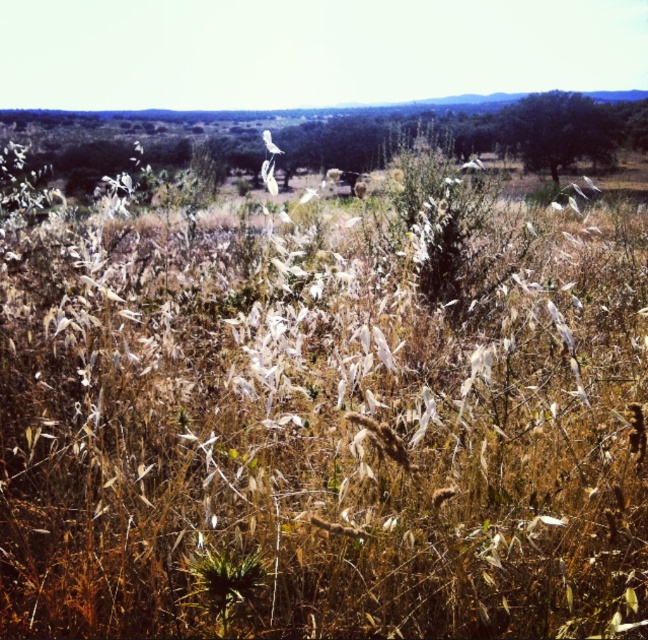
You are an ornithologist observing the white matte bird at center and the green leafy tree at upper right in the field. Which object is smaller in size?

The green leafy tree at upper right is smaller in size compared to the white matte bird at center.

You are standing at the center of the field and want to find the green leafy tree at upper right. Which direction should you look to locate it?

The green leafy tree at upper right is located at coordinates point (x=559, y=131), so you should look towards the upper right direction to find it.